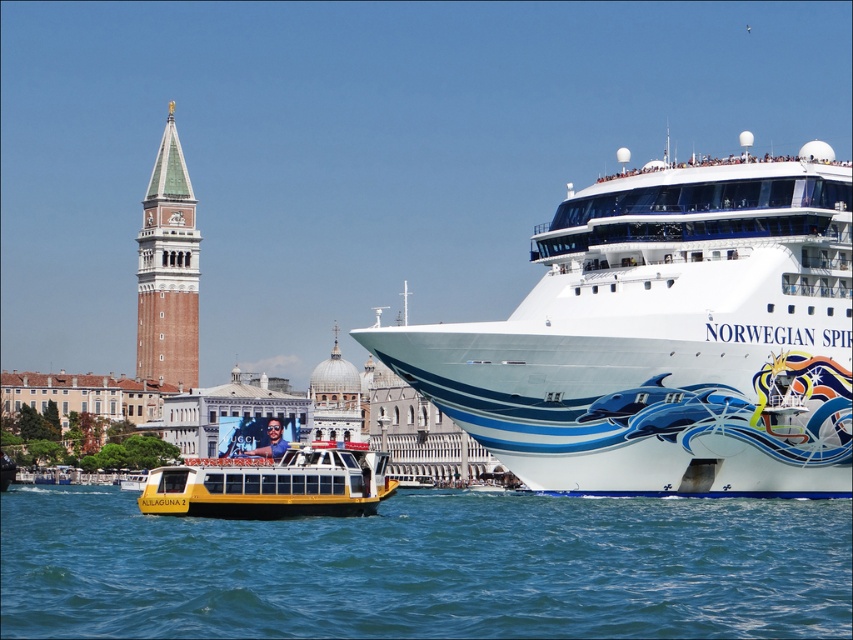
Between blue water at lower left and brick stonework bell tower at upper left, which one appears on the left side from the viewer's perspective?

brick stonework bell tower at upper left

Which is above, blue water at lower left or brick stonework bell tower at upper left?

Positioned higher is brick stonework bell tower at upper left.

Locate an element on the screen. This screenshot has height=640, width=853. blue water at lower left is located at coordinates (428, 568).

Does point (242, 516) come farther from viewer compared to point (146, 212)?

No, it is not.

Describe the element at coordinates (273, 484) in the screenshot. I see `yellow matte/glossy boat at center` at that location.

At what (x,y) coordinates should I click in order to perform the action: click on yellow matte/glossy boat at center. Please return your answer as a coordinate pair (x, y). The height and width of the screenshot is (640, 853). Looking at the image, I should click on (273, 484).

Which is below, blue water at lower left or yellow matte/glossy boat at center?

Positioned lower is blue water at lower left.

Does point (399, 621) come behind point (180, 513)?

That is False.

Locate an element on the screen. The width and height of the screenshot is (853, 640). blue water at lower left is located at coordinates (428, 568).